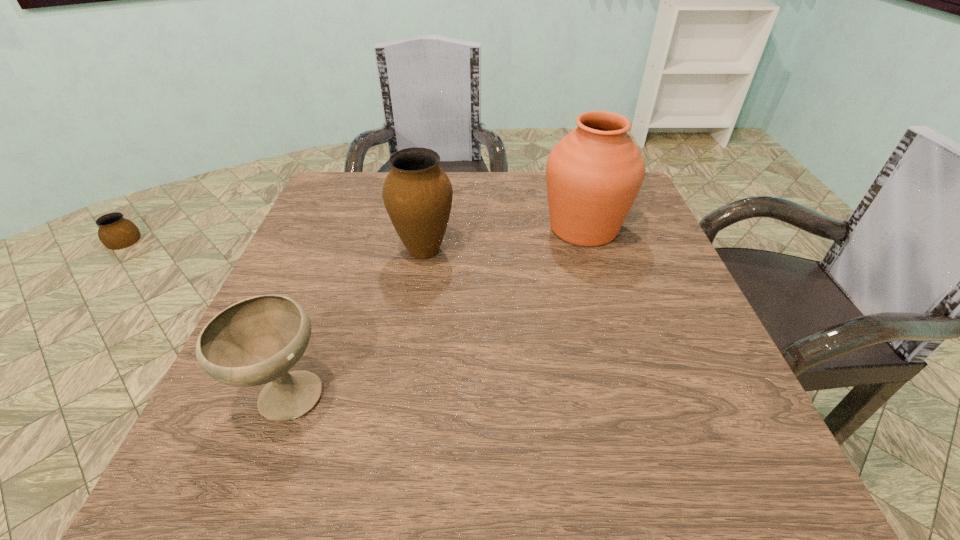
Where is `the right urn`? the right urn is located at coordinates (595, 172).

This screenshot has width=960, height=540. What are the coordinates of `the tallest object` in the screenshot? It's located at (595, 172).

The height and width of the screenshot is (540, 960). Identify the location of the second object from left to right. (417, 194).

The width and height of the screenshot is (960, 540). In order to click on the left urn in this screenshot , I will do coord(417,194).

Where is `the shortest object`? The height and width of the screenshot is (540, 960). the shortest object is located at coordinates (256, 341).

I want to click on the nearest object, so tap(256, 341).

What are the coordinates of `blank area located on the front of the tallest object` in the screenshot? It's located at (636, 406).

Find the location of a particular element. The image size is (960, 540). free region located on the left of the shorter urn is located at coordinates (296, 251).

Find the location of a particular element. This screenshot has width=960, height=540. vacant area situated 0.320m on the right of the shortest object is located at coordinates (527, 395).

Image resolution: width=960 pixels, height=540 pixels. What are the coordinates of `object that is at the far edge` in the screenshot? It's located at (595, 172).